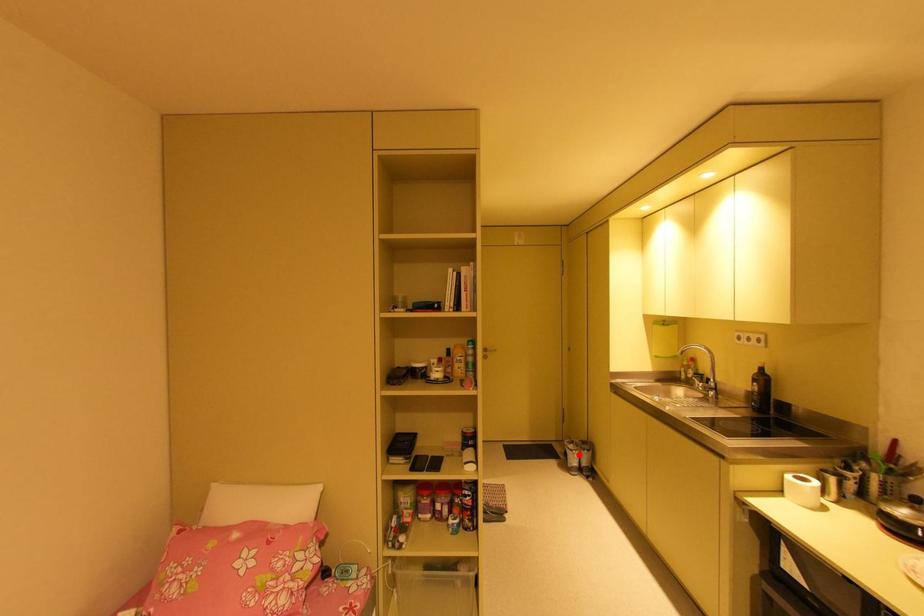
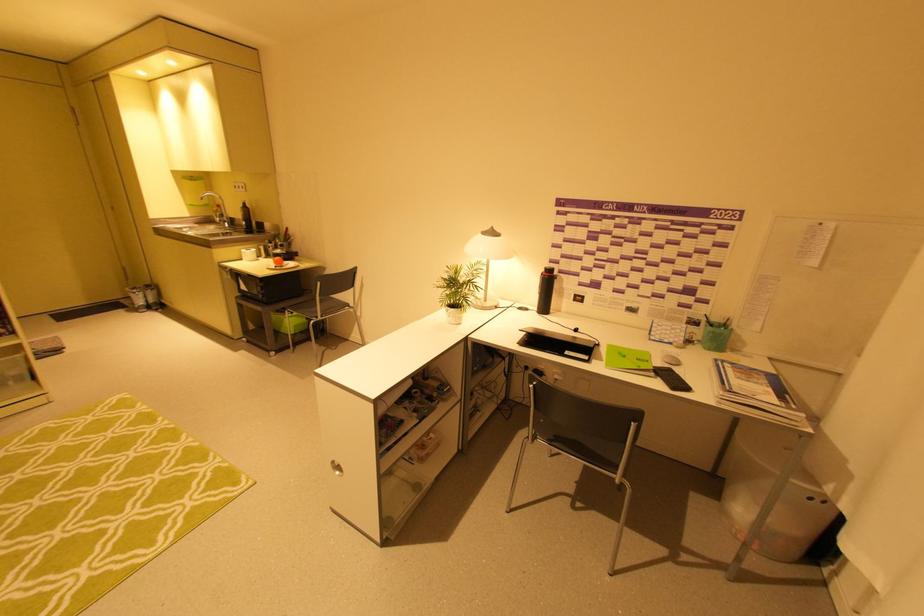
Find the pixel in the second image that matches the highlighted location in the first image.

(142, 296)